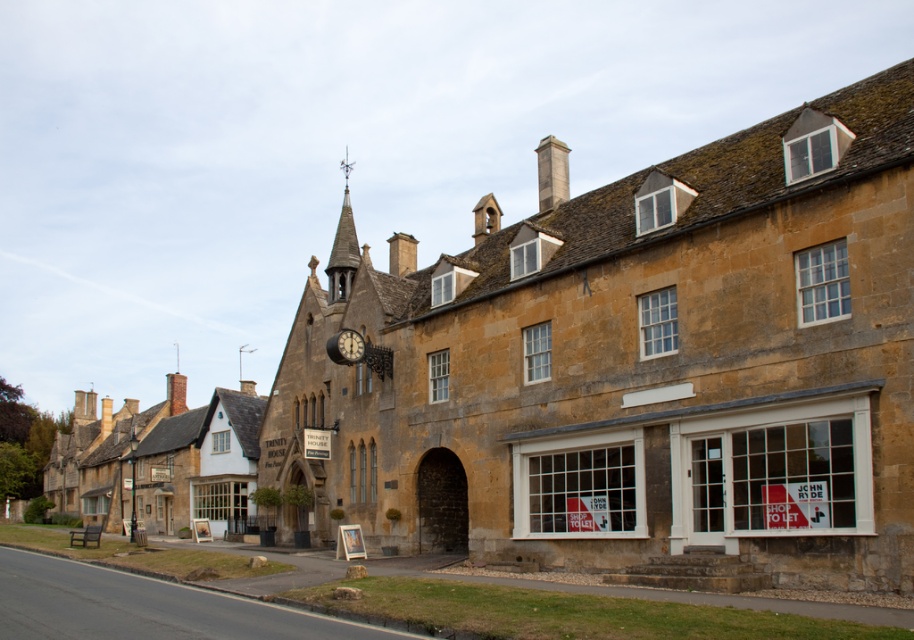
Does smooth stone spire at upper center have a lesser height compared to metallic clock at center?

In fact, smooth stone spire at upper center may be taller than metallic clock at center.

Can you confirm if smooth stone spire at upper center is positioned above metallic clock at center?

Yes.

Identify the location of smooth stone spire at upper center. (343, 246).